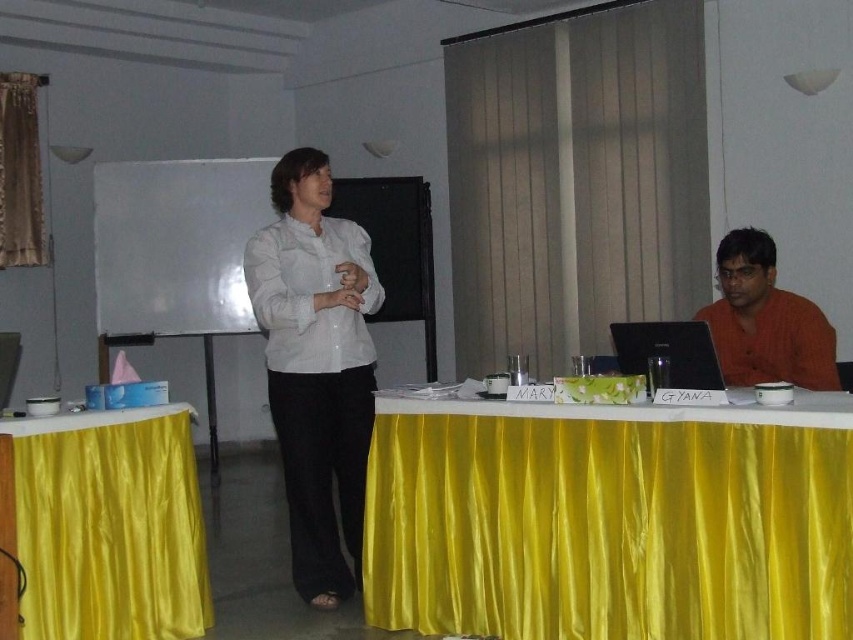
Question: Does yellow satin tablecloth at lower center come in front of gold satin curtain at upper left?

Choices:
 (A) yes
 (B) no

Answer: (A)

Question: Among these points, which one is farthest from the camera?

Choices:
 (A) (602, 429)
 (B) (796, 364)

Answer: (B)

Question: Estimate the real-world distances between objects in this image. Which object is closer to the black glossy laptop at center?

Choices:
 (A) white glossy shirt at center
 (B) brown fabric curtain at upper center
 (C) yellow satin table at lower left

Answer: (A)

Question: Can you confirm if white glossy shirt at center is bigger than gold satin curtain at upper left?

Choices:
 (A) yes
 (B) no

Answer: (A)

Question: Estimate the real-world distances between objects in this image. Which object is closer to the yellow satin table at lower left?

Choices:
 (A) black glossy laptop at center
 (B) white glossy shirt at center

Answer: (B)

Question: Does yellow satin table at lower left appear over brown cotton shirt at right?

Choices:
 (A) no
 (B) yes

Answer: (A)